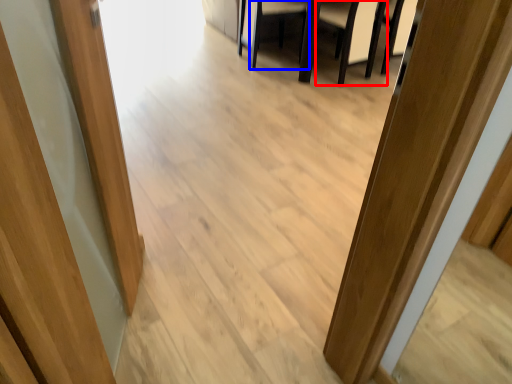
Question: Which object appears closest to the camera in this image, armchair (highlighted by a red box) or armchair (highlighted by a blue box)?

Choices:
 (A) armchair
 (B) armchair

Answer: (A)